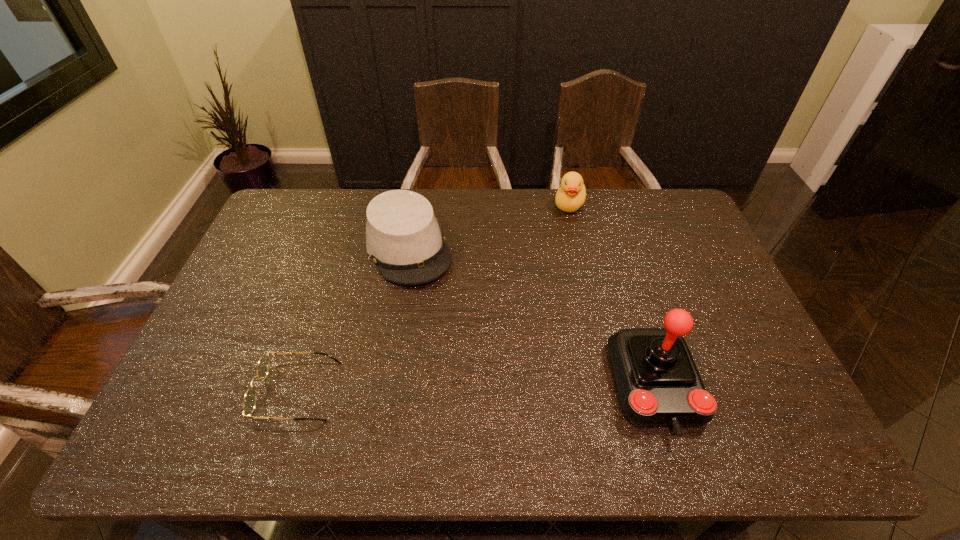
The width and height of the screenshot is (960, 540). I want to click on the shortest object, so click(x=250, y=398).

This screenshot has height=540, width=960. What are the coordinates of `joystick` in the screenshot? It's located at (659, 384).

This screenshot has height=540, width=960. Identify the location of hat. (403, 238).

This screenshot has width=960, height=540. In order to click on duck in this screenshot , I will do `click(571, 195)`.

Identify the location of vacant space situated on the lenses of the shortest object. This screenshot has width=960, height=540. (181, 391).

Locate an element on the screen. The image size is (960, 540). vacant space located 0.180m on the lenses of the shortest object is located at coordinates tap(185, 391).

The image size is (960, 540). Identify the location of vacant space located on the front-facing side of the hat. (431, 299).

You are a GUI agent. You are given a task and a screenshot of the screen. Output one action in this format:
    pyautogui.click(x=<x>, y=<y>)
    Task: Click on the free space located 0.120m on the front-facing side of the hat
    The image size is (960, 540).
    Given the screenshot: What is the action you would take?
    pyautogui.click(x=439, y=313)

Identify the location of free region located 0.260m on the front-facing side of the hat. The height and width of the screenshot is (540, 960). (459, 349).

At what (x,y) coordinates should I click in order to perform the action: click on free space located at the beak of the duck. Please return your answer as a coordinate pair (x, y). Image resolution: width=960 pixels, height=540 pixels. Looking at the image, I should click on (553, 244).